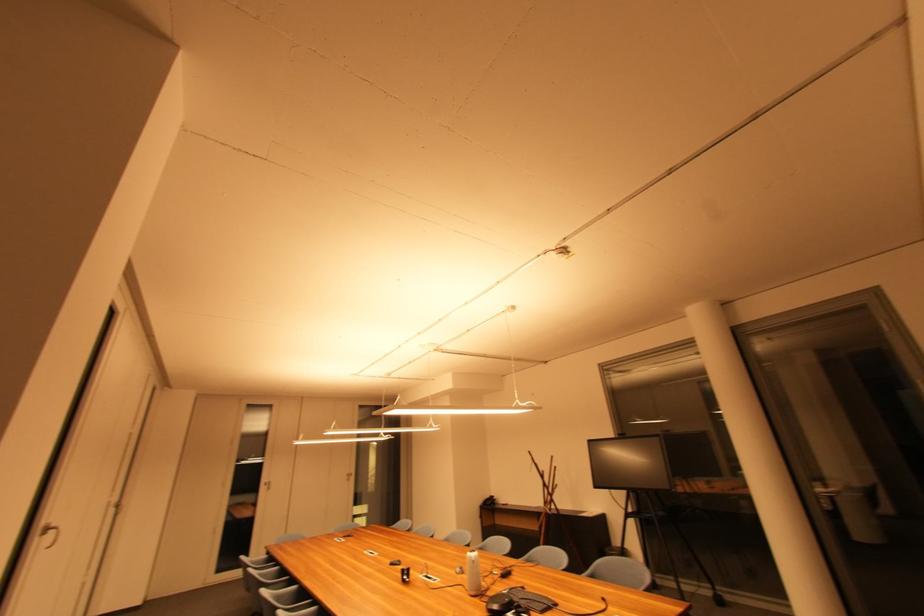
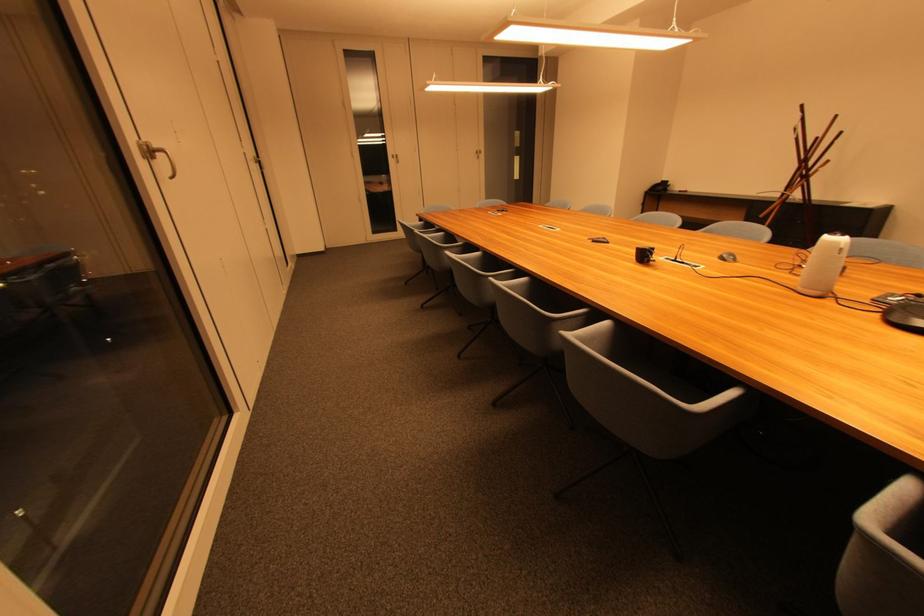
Where in the second image is the point corresponding to the point at 410,578 from the first image?

(649, 257)